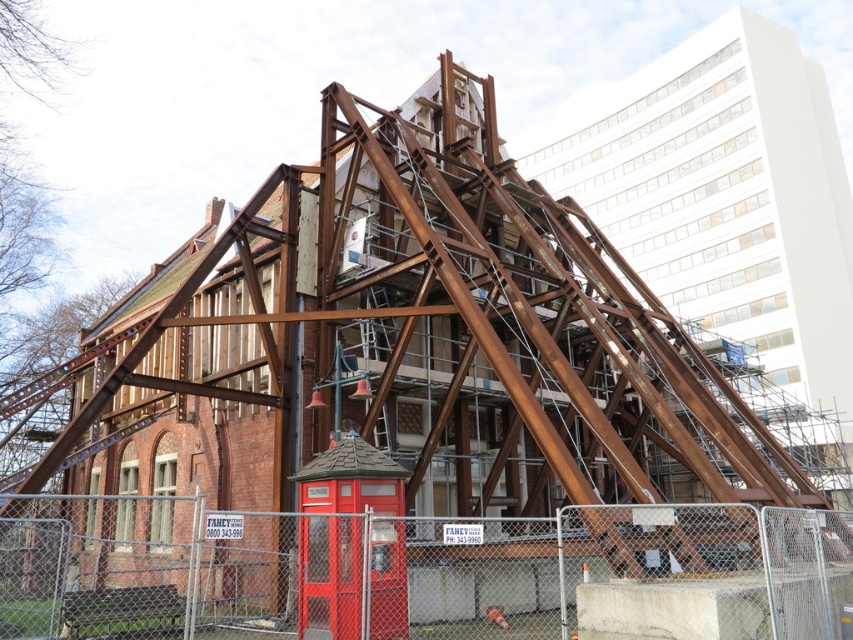
You are standing at the construction site of the building with exposed wooden framework. You see a red telephone booth and a point marked at coordinates point (x=396, y=568). What object is the point located on?

The point (x=396, y=568) is located on the metal chain link fence at lower center.